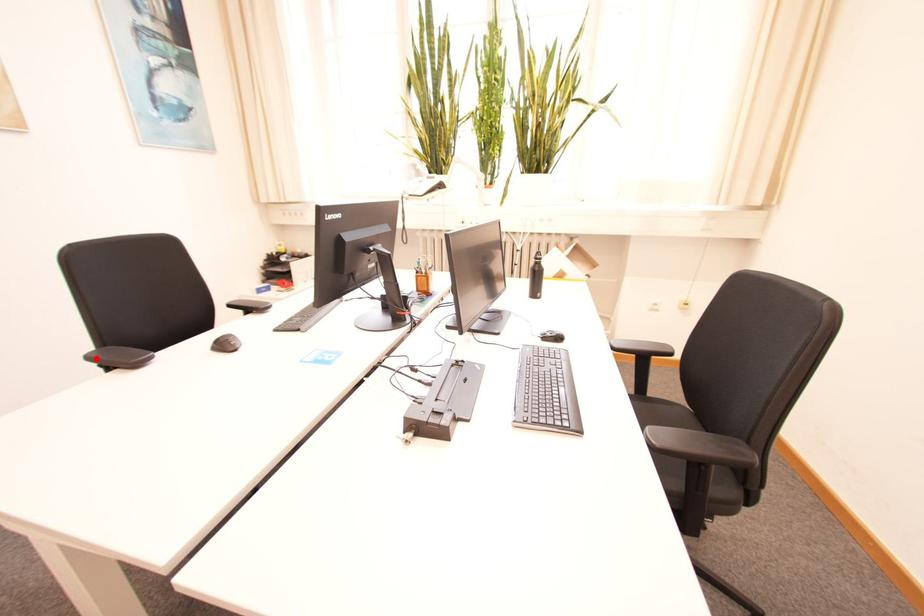
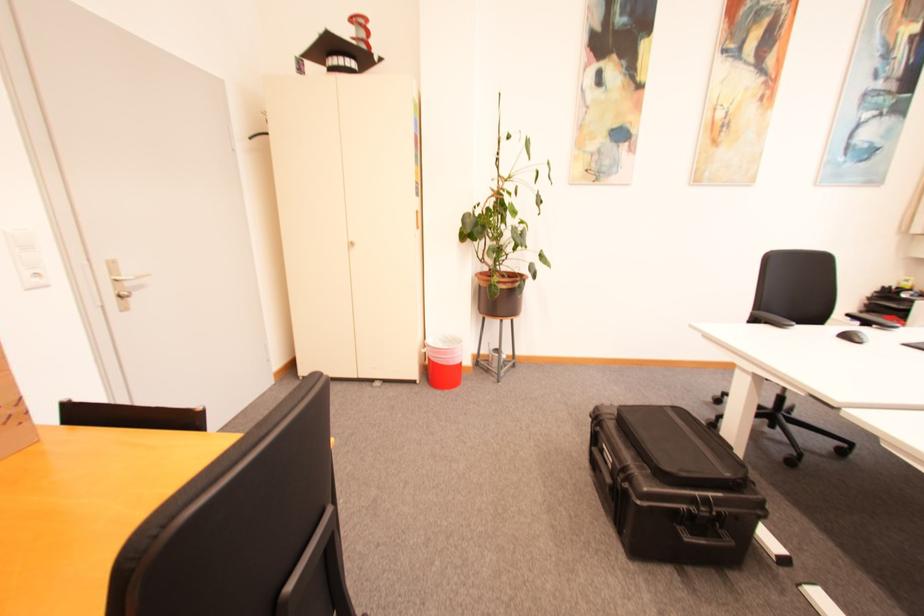
Locate, in the second image, the point that corresponds to the highlighted location in the first image.

(759, 315)